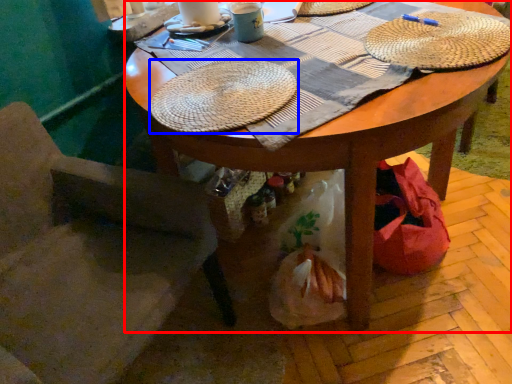
Question: Which point is further to the camera, desk (highlighted by a red box) or hat (highlighted by a blue box)?

Choices:
 (A) desk
 (B) hat

Answer: (B)